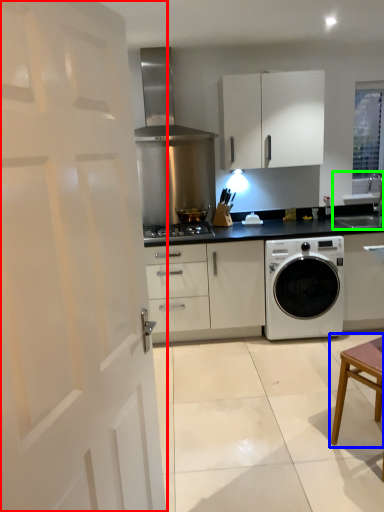
Question: Which object is positioned closest to door (highlighted by a red box)? Select from table (highlighted by a blue box) and sink (highlighted by a green box).

Choices:
 (A) table
 (B) sink

Answer: (A)